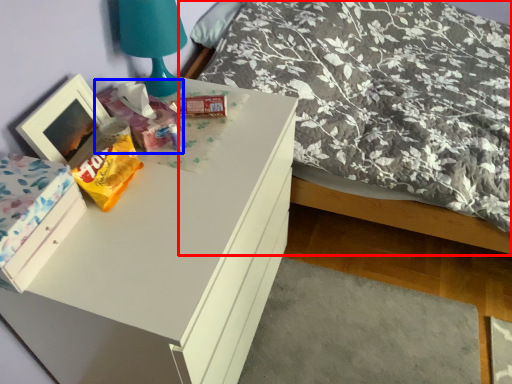
Question: Among these objects, which one is nearest to the camera, bed (highlighted by a red box) or package (highlighted by a blue box)?

Choices:
 (A) bed
 (B) package

Answer: (A)